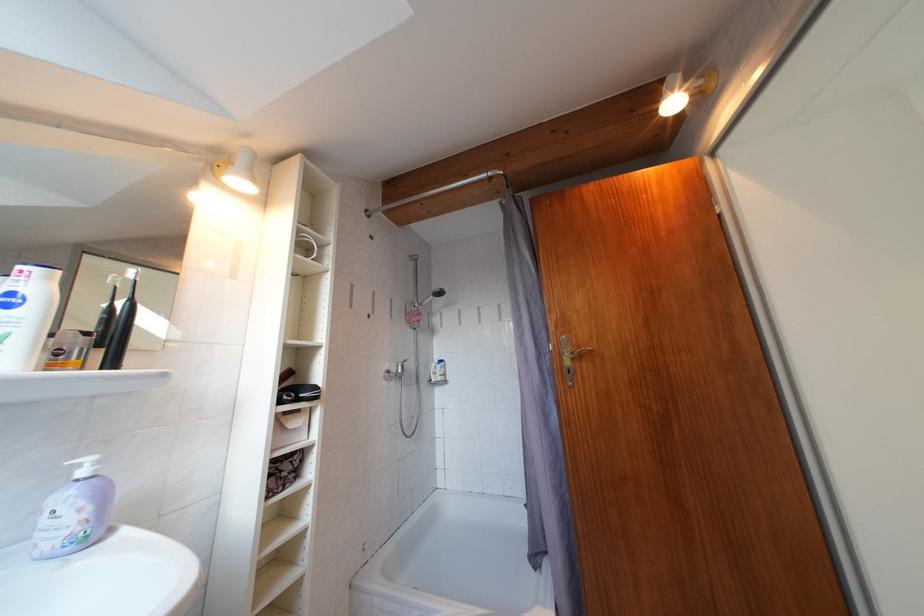
Locate an element on the screen. Image resolution: width=924 pixels, height=616 pixels. handheld shower head is located at coordinates (435, 293).